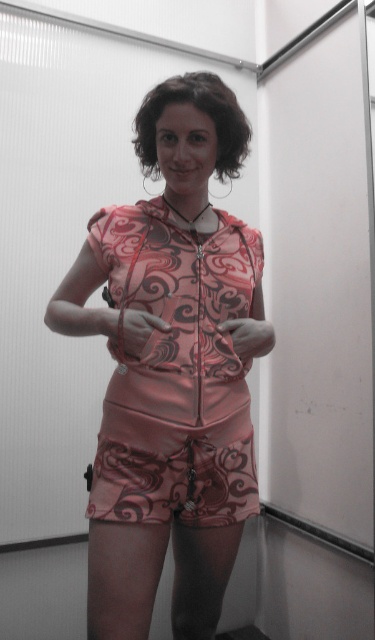
Question: Which point is farther to the camera?

Choices:
 (A) pink satin shorts at center
 (B) pink satin dress at center

Answer: (A)

Question: Does satin pink romper at center appear on the left side of pink satin dress at center?

Choices:
 (A) no
 (B) yes

Answer: (B)

Question: Where is satin pink romper at center located in relation to pink satin shorts at center in the image?

Choices:
 (A) above
 (B) below

Answer: (A)

Question: Where is satin pink romper at center located in relation to pink satin shorts at center in the image?

Choices:
 (A) right
 (B) left

Answer: (B)

Question: Which of the following is the closest to the observer?

Choices:
 (A) (172, 458)
 (B) (270, 339)

Answer: (A)

Question: Which object is the farthest from the pink satin shorts at center?

Choices:
 (A) pink satin dress at center
 (B) satin pink romper at center

Answer: (B)